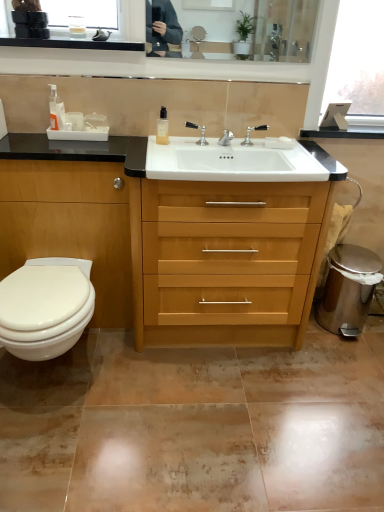
Locate an element on the screen. vacant area located to the right-hand side of clear glass bottle at center, placed as the second toiletry when sorted from left to right is located at coordinates (192, 146).